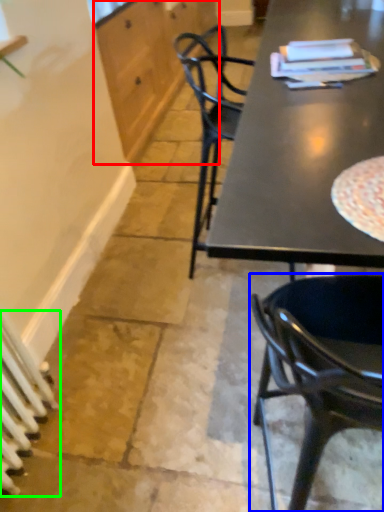
Question: Which object is the closest to the cabinetry (highlighted by a red box)? Choose among these: chair (highlighted by a blue box) or radiator (highlighted by a green box).

Choices:
 (A) chair
 (B) radiator

Answer: (B)